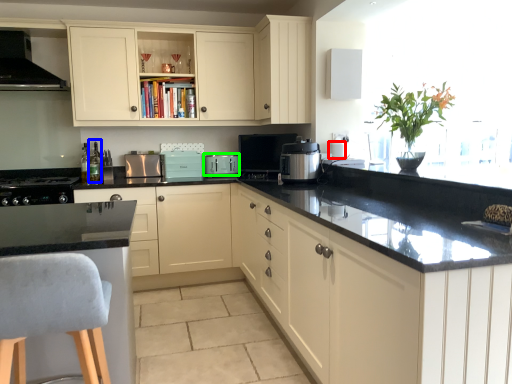
Question: Which object is positioned closest to appliance (highlighted by a red box)? Select from bottle (highlighted by a blue box) and kitchen appliance (highlighted by a green box).

Choices:
 (A) bottle
 (B) kitchen appliance

Answer: (B)